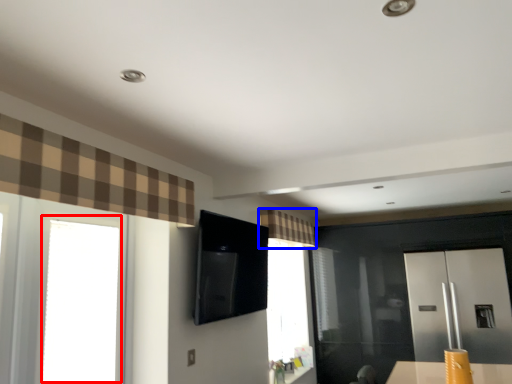
Question: Which point is closer to the camera, window (highlighted by a red box) or curtain (highlighted by a blue box)?

Choices:
 (A) window
 (B) curtain

Answer: (A)